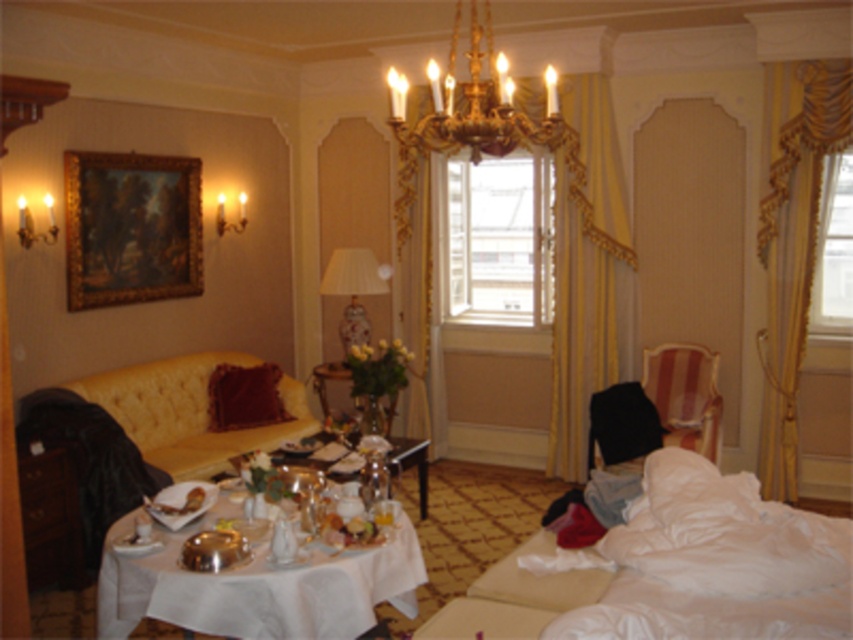
Question: Does white cloth-covered table at center appear over satin silver plate at lower left?

Choices:
 (A) yes
 (B) no

Answer: (B)

Question: Which point is farther to the camera?

Choices:
 (A) striped fabric armchair at right
 (B) gold/yellow fabric curtain at center
 (C) velvet red pillow at center
 (D) satin silver plate at lower left

Answer: (B)

Question: Can you confirm if gold textured curtain at right is positioned above striped fabric armchair at right?

Choices:
 (A) no
 (B) yes

Answer: (B)

Question: Considering the real-world distances, which object is farthest from the white cloth-covered table at center?

Choices:
 (A) yellow fabric curtain at center
 (B) white fluffy bed at lower right
 (C) striped fabric armchair at right

Answer: (A)

Question: Which point appears farthest from the camera in this image?

Choices:
 (A) (804, 173)
 (B) (491, 624)

Answer: (A)

Question: Is white fluffy bed at lower right to the left of gold/yellow fabric curtain at center from the viewer's perspective?

Choices:
 (A) yes
 (B) no

Answer: (B)